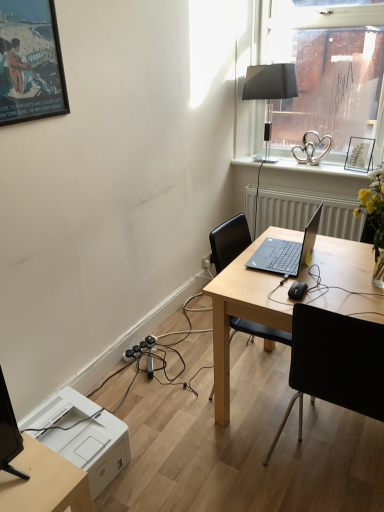
I want to click on free spot to the right of black plastic mouse at lower right, so click(x=339, y=289).